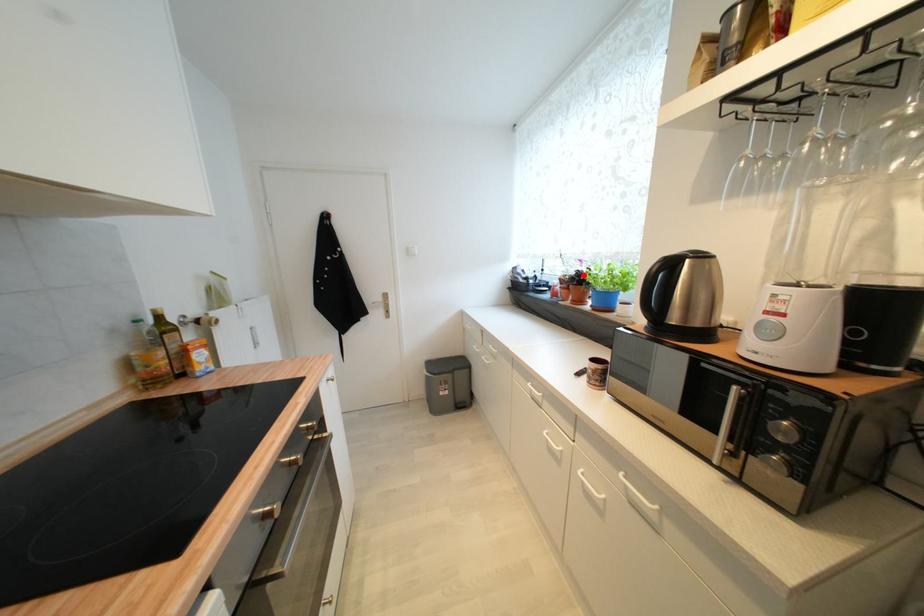
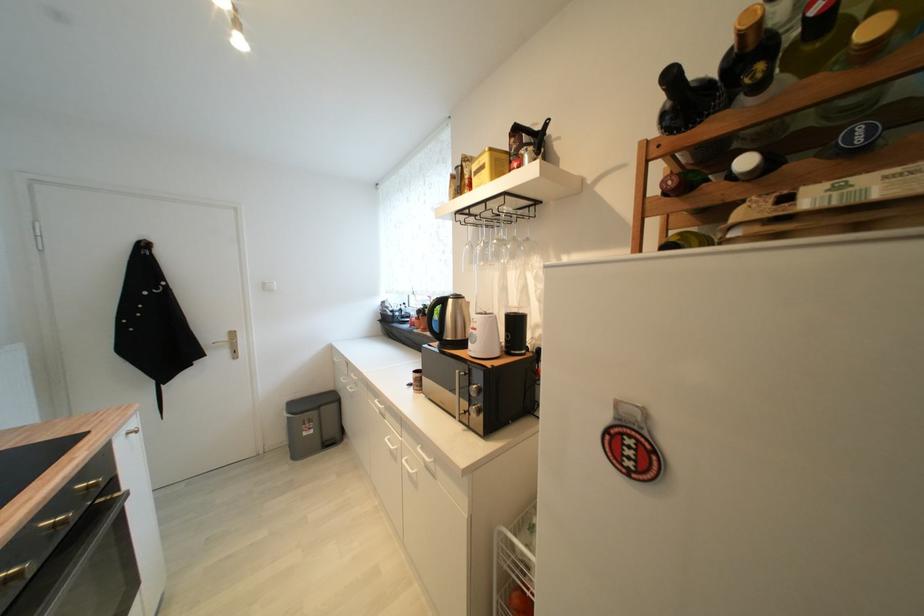
Question: I am providing you with two images of the same scene from different viewpoints. Given a red point in image1, look at the same physical point in image2. Is it:

Choices:
 (A) Closer to the viewpoint
 (B) Farther from the viewpoint

Answer: (B)